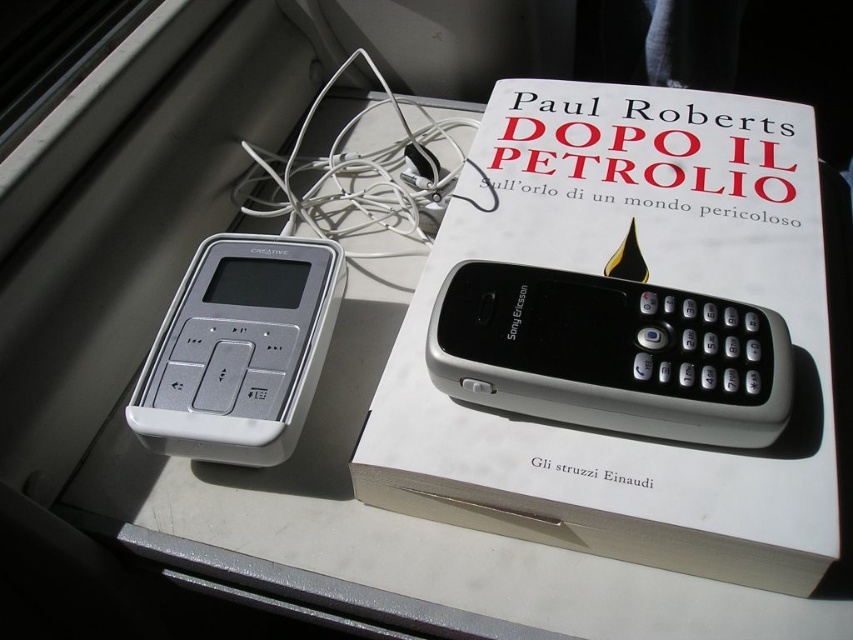
Between black plastic sony ericsson phone at center and white plastic ipod at upper left, which one appears on the left side from the viewer's perspective?

Positioned to the left is white plastic ipod at upper left.

Which is more to the right, black plastic sony ericsson phone at center or white plastic ipod at upper left?

Positioned to the right is black plastic sony ericsson phone at center.

At what (x,y) coordinates should I click in order to perform the action: click on black plastic sony ericsson phone at center. Please return your answer as a coordinate pair (x, y). This screenshot has height=640, width=853. Looking at the image, I should click on (610, 355).

Where is `black plastic sony ericsson phone at center`? The width and height of the screenshot is (853, 640). black plastic sony ericsson phone at center is located at coordinates (610, 355).

What do you see at coordinates (640, 292) in the screenshot? The width and height of the screenshot is (853, 640). I see `white matte book at upper center` at bounding box center [640, 292].

Which is behind, point (604, 138) or point (747, 346)?

Point (604, 138)

Find the location of a particular element. The image size is (853, 640). white matte book at upper center is located at coordinates (640, 292).

Where is `white matte book at upper center`? Image resolution: width=853 pixels, height=640 pixels. white matte book at upper center is located at coordinates (640, 292).

Who is more forward, (445, 273) or (265, 440)?

Positioned in front is point (265, 440).

Locate an element on the screen. white matte book at upper center is located at coordinates (640, 292).